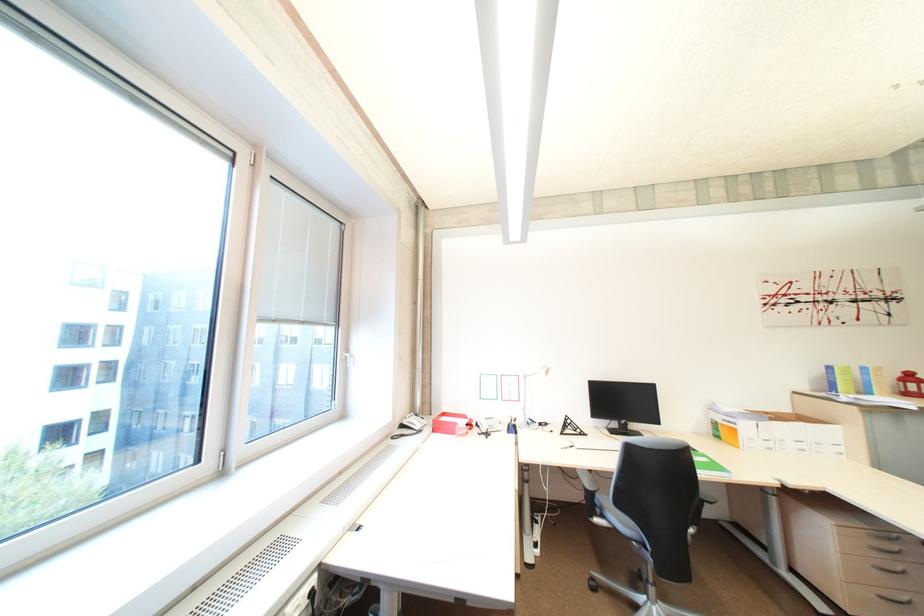
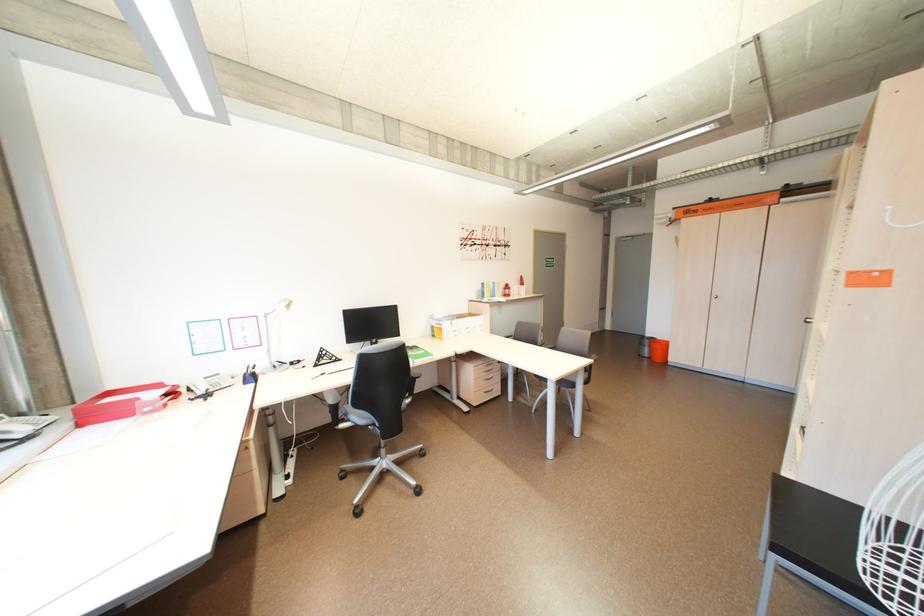
Question: How did the camera likely rotate?

Choices:
 (A) Left
 (B) Right
 (C) Up
 (D) Down

Answer: (B)